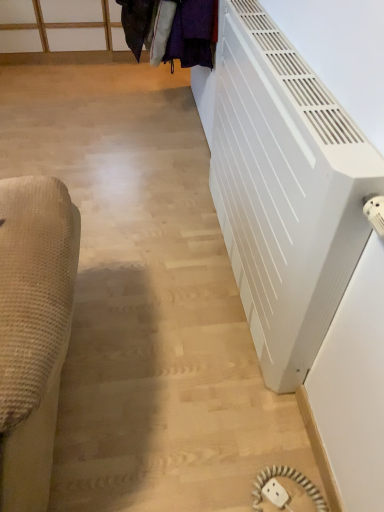
At what (x,y) coordinates should I click in order to perform the action: click on free spot to the left of white matte radiator at right. Please return your answer as a coordinate pair (x, y). Image resolution: width=384 pixels, height=512 pixels. Looking at the image, I should click on (146, 257).